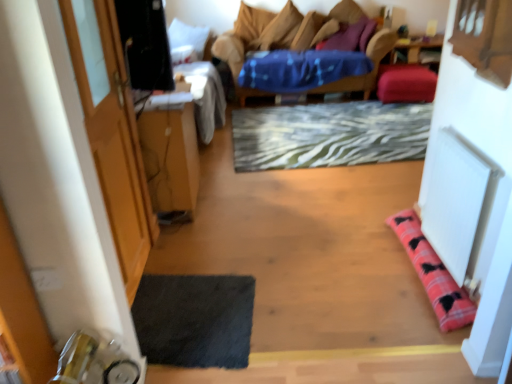
Image resolution: width=512 pixels, height=384 pixels. What are the coordinates of `vacant area that is in front of zebra-patterned rug at center` in the screenshot? It's located at (309, 240).